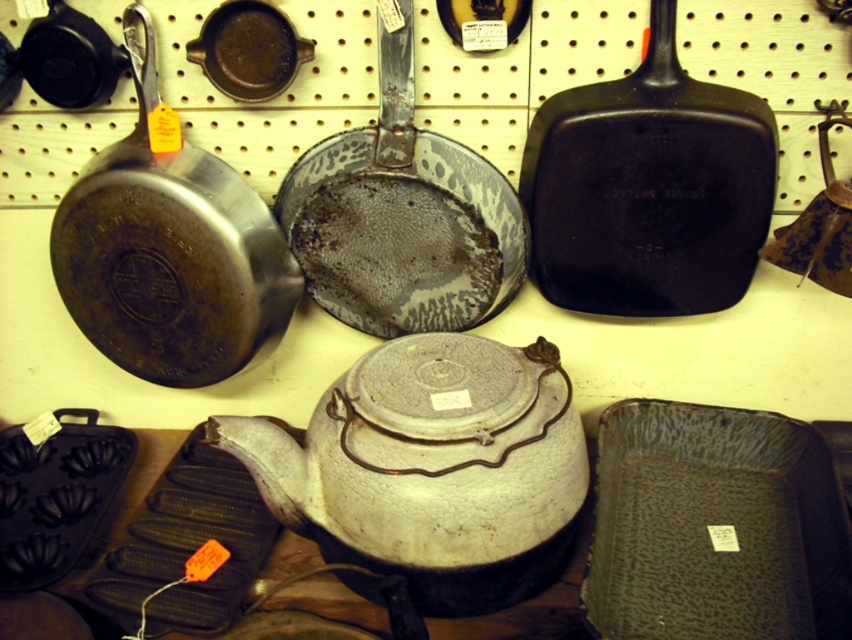
You are a customer in a thrift store and want to reach an item located at point [130,173]. The store has a rule that you must stay at least 1 meter away from the display. Can you safely approach the display to view the item?

The distance between point [130,173] and the camera is 97.32 centimeters. Since the store requires staying at least 1 meter away, you cannot safely approach closer than the current distance as it is less than the required 100 cm.

You are standing in front of a vintage cookware display on a pegboard wall. You notice a specific point marked at coordinates point (631, 280). If you want to reach this point with your hand, which of the following would be the best estimate of how far you need to stretch?

The point (631, 280) is 3.51 feet away from the viewer, so you would need to stretch approximately 3.5 feet to reach it.

You are a customer at the thrift store and want to place both the matte black frying pan at left and the matte cast iron skillet at upper center on your kitchen counter. Your counter has a space that is 1.2 meters wide. If you place them side by side, will they fit?

The matte black frying pan at left is wider than the matte cast iron skillet at upper center. Since the total width of both items combined would exceed 1.2 meters, they might not fit side by side on the counter space provided.